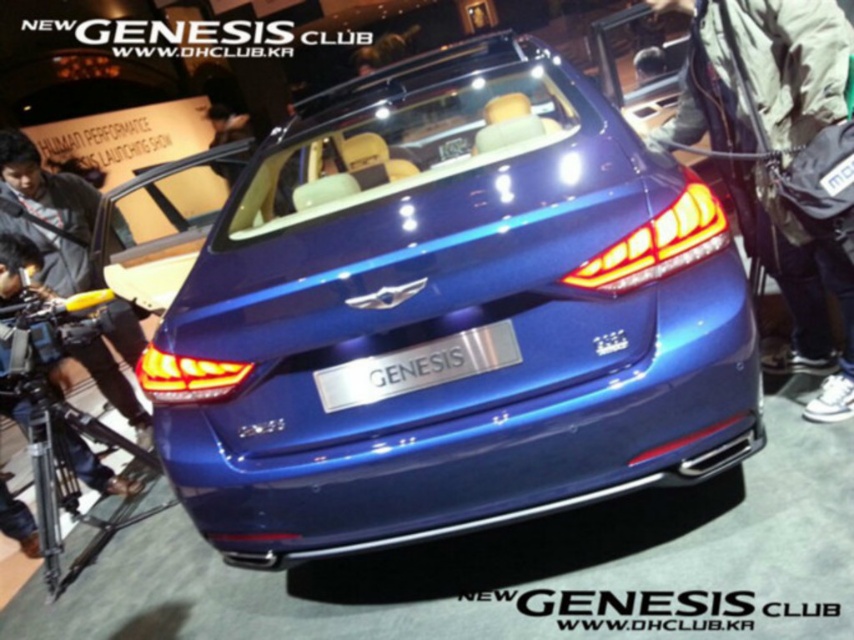
Question: Does dark blue leather jacket at left appear on the left side of silver metallic plate at center?

Choices:
 (A) yes
 (B) no

Answer: (A)

Question: Can you confirm if dark blue leather jacket at right is positioned below dark blue leather jacket at left?

Choices:
 (A) yes
 (B) no

Answer: (A)

Question: Which is nearer to the silver metallic plate at center?

Choices:
 (A) metallic blue car at center
 (B) dark blue leather jacket at right
 (C) dark blue leather jacket at left

Answer: (A)

Question: Is dark blue leather jacket at right further to camera compared to silver metallic plate at center?

Choices:
 (A) no
 (B) yes

Answer: (B)

Question: Which of these objects is positioned farthest from the silver metallic plate at center?

Choices:
 (A) metallic blue car at center
 (B) dark blue leather jacket at right

Answer: (B)

Question: Which point is closer to the camera taking this photo?

Choices:
 (A) (722, 49)
 (B) (506, 337)
 (C) (117, 368)
 (D) (554, 266)

Answer: (D)